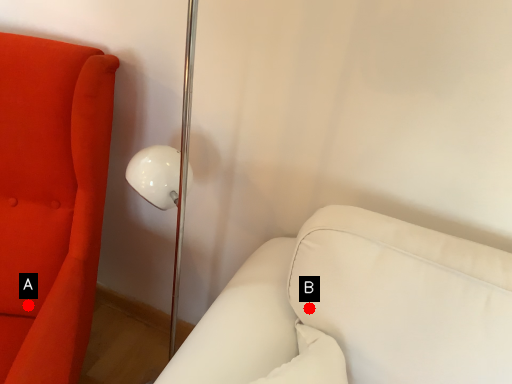
Question: Two points are circled on the image, labeled by A and B beside each circle. Which point appears farthest from the camera in this image?

Choices:
 (A) A is further
 (B) B is further

Answer: (A)